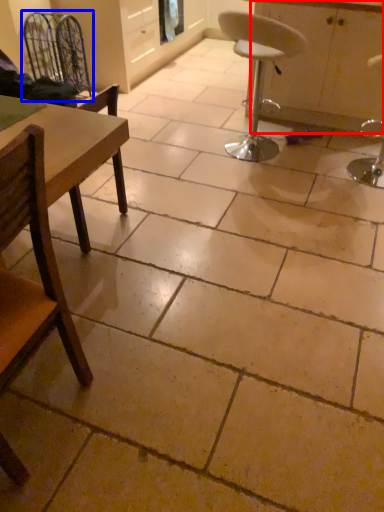
Question: Among these objects, which one is farthest to the camera, cabinetry (highlighted by a red box) or swivel chair (highlighted by a blue box)?

Choices:
 (A) cabinetry
 (B) swivel chair

Answer: (B)